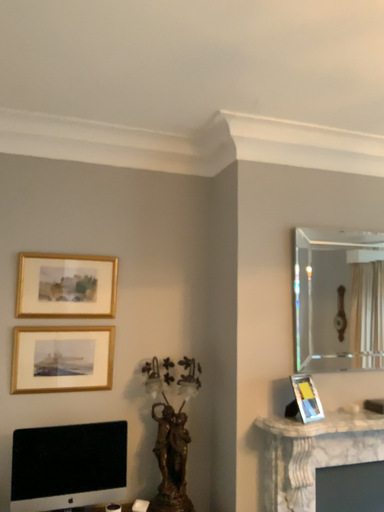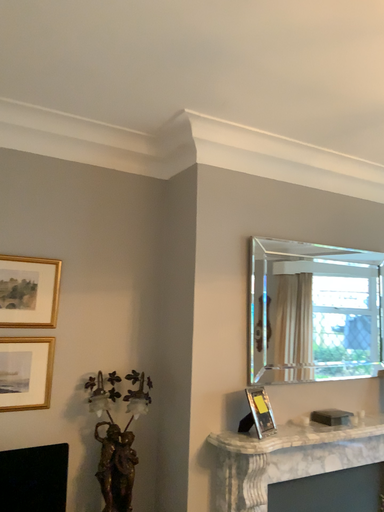
Question: How did the camera likely rotate when shooting the video?

Choices:
 (A) rotated right
 (B) rotated left

Answer: (A)